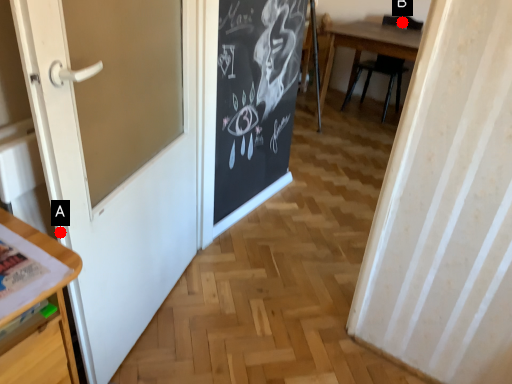
Question: Two points are circled on the image, labeled by A and B beside each circle. Which point is closer to the camera?

Choices:
 (A) A is closer
 (B) B is closer

Answer: (A)